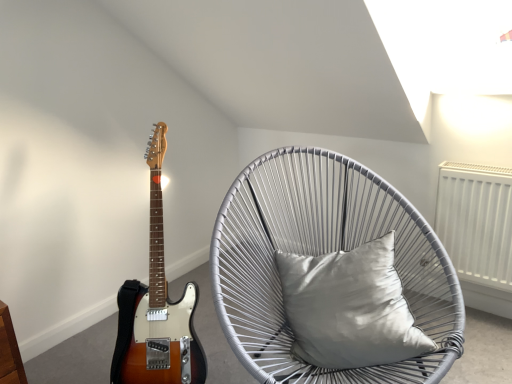
Question: Considering the relative sizes of satin wood guitar at left and satin silver pillow at center in the image provided, is satin wood guitar at left wider than satin silver pillow at center?

Choices:
 (A) yes
 (B) no

Answer: (A)

Question: From the image's perspective, is satin wood guitar at left over satin silver pillow at center?

Choices:
 (A) yes
 (B) no

Answer: (A)

Question: Is satin wood guitar at left taller than satin silver pillow at center?

Choices:
 (A) no
 (B) yes

Answer: (B)

Question: From the image's perspective, is satin wood guitar at left located beneath satin silver pillow at center?

Choices:
 (A) no
 (B) yes

Answer: (A)

Question: Is satin wood guitar at left thinner than satin silver pillow at center?

Choices:
 (A) no
 (B) yes

Answer: (A)

Question: Based on their positions, is satin wood guitar at left located to the left or right of satin silver pillow at center?

Choices:
 (A) right
 (B) left

Answer: (B)

Question: From the image's perspective, relative to satin silver pillow at center, is satin wood guitar at left above or below?

Choices:
 (A) below
 (B) above

Answer: (B)

Question: From their relative heights in the image, would you say satin wood guitar at left is taller or shorter than satin silver pillow at center?

Choices:
 (A) tall
 (B) short

Answer: (A)

Question: Looking at the image, does satin wood guitar at left seem bigger or smaller compared to satin silver pillow at center?

Choices:
 (A) small
 (B) big

Answer: (B)

Question: Is point (194, 374) positioned closer to the camera than point (373, 380)?

Choices:
 (A) farther
 (B) closer

Answer: (A)

Question: From the image's perspective, is satin wood guitar at left located above or below silver woven chair with cushion at center?

Choices:
 (A) below
 (B) above

Answer: (B)

Question: Considering their positions, is satin wood guitar at left located in front of or behind silver woven chair with cushion at center?

Choices:
 (A) behind
 (B) front

Answer: (A)

Question: Looking at the image, does satin wood guitar at left seem bigger or smaller compared to silver woven chair with cushion at center?

Choices:
 (A) small
 (B) big

Answer: (A)

Question: Is satin silver pillow at center situated inside silver woven chair with cushion at center or outside?

Choices:
 (A) outside
 (B) inside

Answer: (B)

Question: Is satin silver pillow at center bigger or smaller than silver woven chair with cushion at center?

Choices:
 (A) big
 (B) small

Answer: (B)